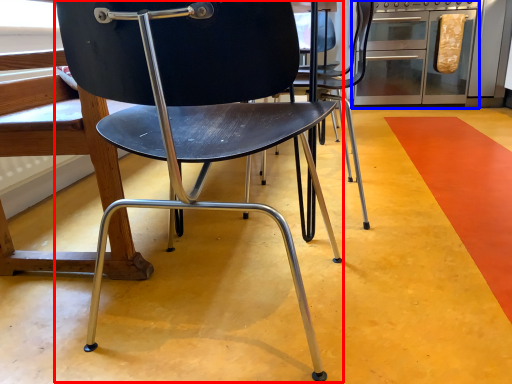
Question: Among these objects, which one is farthest to the camera, chair (highlighted by a red box) or oven (highlighted by a blue box)?

Choices:
 (A) chair
 (B) oven

Answer: (B)